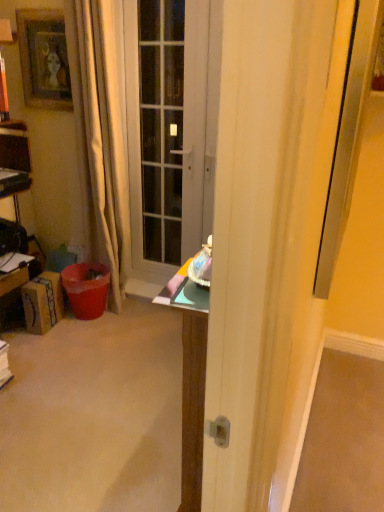
Question: Is matte gray door at center facing away from beige fabric curtain at left?

Choices:
 (A) yes
 (B) no

Answer: (B)

Question: Considering the relative positions of matte gray door at center and beige fabric curtain at left in the image provided, is matte gray door at center to the left of beige fabric curtain at left from the viewer's perspective?

Choices:
 (A) yes
 (B) no

Answer: (B)

Question: From a real-world perspective, is matte gray door at center on beige fabric curtain at left?

Choices:
 (A) no
 (B) yes

Answer: (B)

Question: Is matte gray door at center beside beige fabric curtain at left?

Choices:
 (A) no
 (B) yes

Answer: (A)

Question: Does matte gray door at center have a lesser width compared to beige fabric curtain at left?

Choices:
 (A) yes
 (B) no

Answer: (A)

Question: From a real-world perspective, is matte gray door at center located beneath beige fabric curtain at left?

Choices:
 (A) yes
 (B) no

Answer: (B)

Question: Is beige fabric curtain at left to the right of matte gray door at center from the viewer's perspective?

Choices:
 (A) yes
 (B) no

Answer: (B)

Question: Is beige fabric curtain at left thinner than matte gray door at center?

Choices:
 (A) no
 (B) yes

Answer: (A)

Question: Is beige fabric curtain at left turned away from matte gray door at center?

Choices:
 (A) yes
 (B) no

Answer: (B)

Question: From the image's perspective, is beige fabric curtain at left on matte gray door at center?

Choices:
 (A) yes
 (B) no

Answer: (B)

Question: From a real-world perspective, is beige fabric curtain at left located higher than matte gray door at center?

Choices:
 (A) yes
 (B) no

Answer: (B)

Question: Is there a large distance between beige fabric curtain at left and matte gray door at center?

Choices:
 (A) no
 (B) yes

Answer: (A)

Question: Considering the relative sizes of beige fabric curtain at left and wooden framed picture at upper left in the image provided, is beige fabric curtain at left shorter than wooden framed picture at upper left?

Choices:
 (A) no
 (B) yes

Answer: (A)